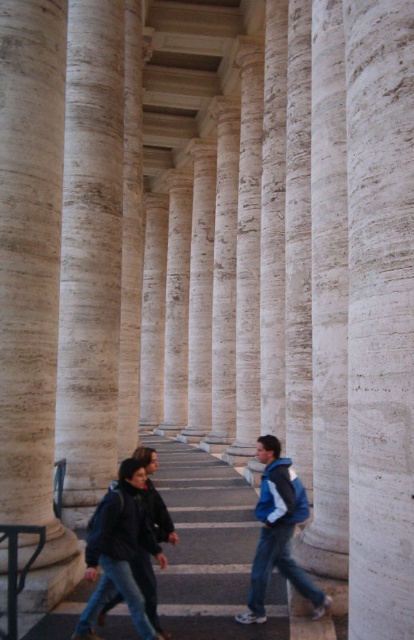
Does point (129, 536) lie behind point (291, 532)?

No.

Is point (96, 536) farther from viewer compared to point (279, 502)?

No, it is in front of (279, 502).

You are a GUI agent. You are given a task and a screenshot of the screen. Output one action in this format:
    pyautogui.click(x=<x>, y=<y>)
    Task: Click on the dark blue jacket at center
    
    Given the screenshot: What is the action you would take?
    pyautogui.click(x=124, y=550)

Consider the image. Who is positioned more to the left, smooth white column at center or blue fleece jacket at center?

smooth white column at center is more to the left.

Can you confirm if smooth white column at center is shorter than blue fleece jacket at center?

No, smooth white column at center is not shorter than blue fleece jacket at center.

Does point (17, 252) come farther from viewer compared to point (264, 493)?

No, (17, 252) is in front of (264, 493).

This screenshot has width=414, height=640. Identify the location of smooth white column at center. (31, 282).

How far apart are smooth white column at center and black metal balustrade at lower left?

smooth white column at center and black metal balustrade at lower left are 6.22 meters apart.

Image resolution: width=414 pixels, height=640 pixels. I want to click on smooth white column at center, so click(x=31, y=282).